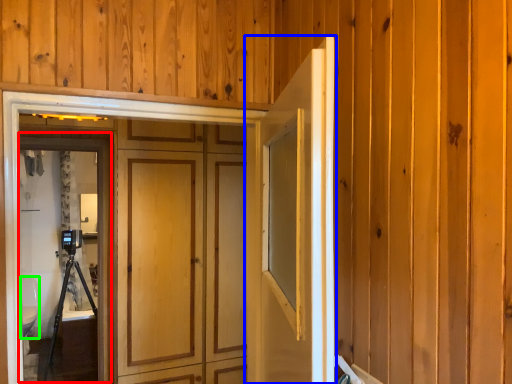
Question: Which object is positioned closest to screen door (highlighted by a red box)? Select from door (highlighted by a blue box) and toilet bowl (highlighted by a green box).

Choices:
 (A) door
 (B) toilet bowl

Answer: (B)